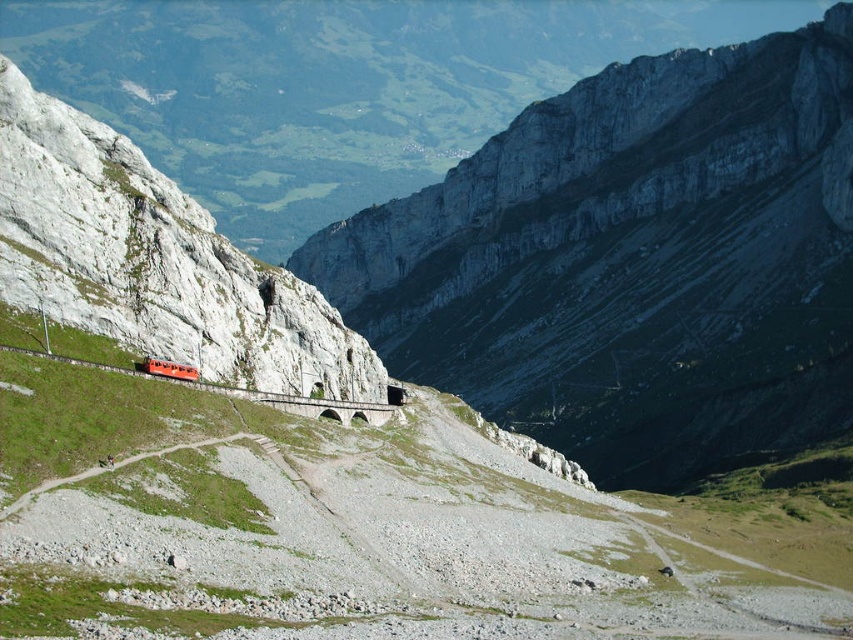
You are a hiker planning to take the gravel path up the slope. You notice two trains, the matte red train at left and the matte orange train at center, on the railway below. Which train appears closer to you based on their sizes?

The matte red train at left appears closer because it has a larger size compared to the matte orange train at center.